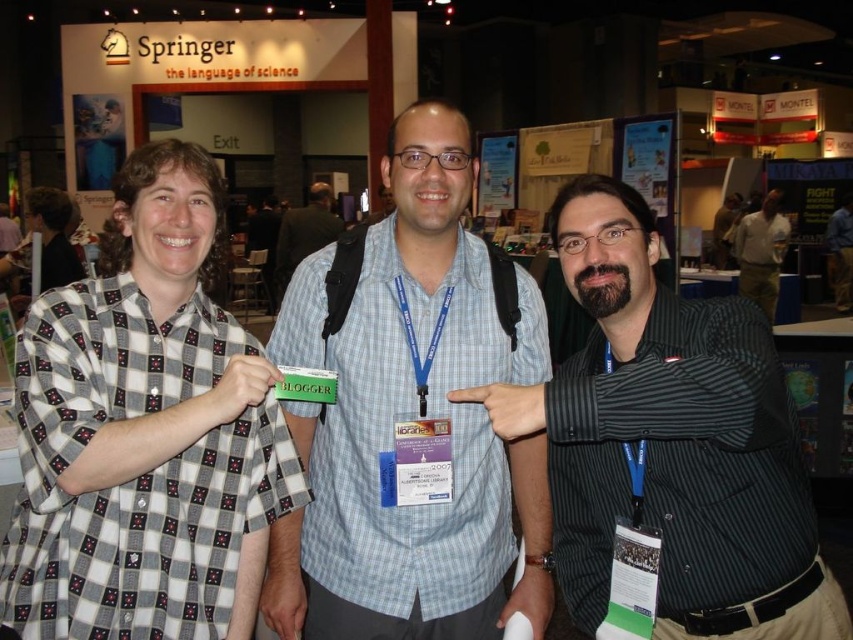
Question: Among these points, which one is nearest to the camera?

Choices:
 (A) (144, 342)
 (B) (773, 273)
 (C) (849, 202)
 (D) (315, 224)

Answer: (A)

Question: Can you confirm if striped shirt at center is positioned above white cotton shirt at center?

Choices:
 (A) no
 (B) yes

Answer: (A)

Question: Among these points, which one is nearest to the camera?

Choices:
 (A) (312, 216)
 (B) (219, 620)
 (C) (297, 516)

Answer: (B)

Question: Can you confirm if striped shirt at center is positioned below white cotton shirt at center?

Choices:
 (A) no
 (B) yes

Answer: (B)

Question: Estimate the real-world distances between objects in this image. Which object is closer to the light blue checkered shirt at center?

Choices:
 (A) blue plaid shirt at center
 (B) white cotton shirt at center
 (C) checkered fabric shirt at center

Answer: (B)

Question: Is checkered fabric shirt at center closer to camera compared to blue shirt at center?

Choices:
 (A) no
 (B) yes

Answer: (B)